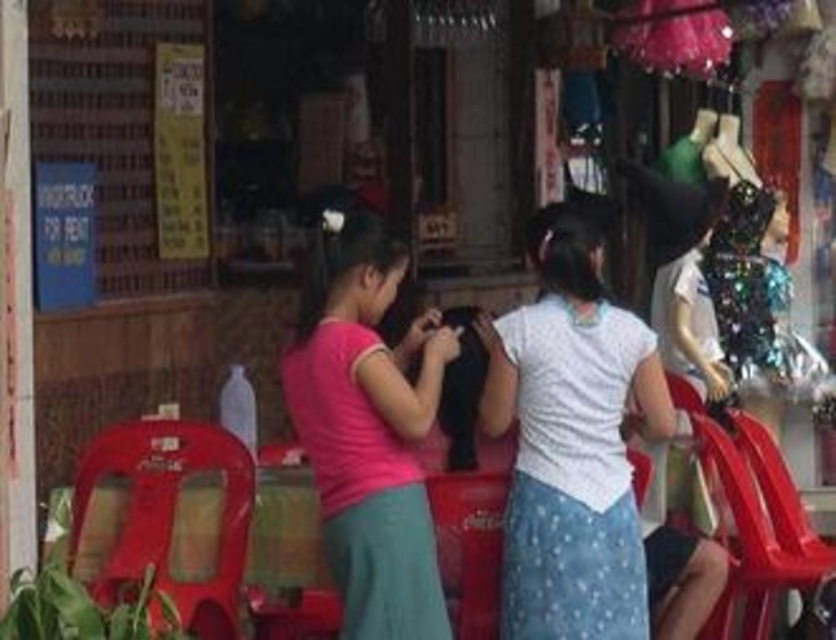
Question: Which of the following is the farthest from the observer?

Choices:
 (A) (748, 301)
 (B) (543, 262)
 (C) (696, 412)

Answer: (A)

Question: Is white matte shirt at center closer to camera compared to matte plastic chair at lower left?

Choices:
 (A) no
 (B) yes

Answer: (A)

Question: Which object is positioned closest to the pink matte shirt at center?

Choices:
 (A) white matte shirt at center
 (B) metallic red chair at lower right
 (C) matte plastic chair at lower left

Answer: (A)

Question: Considering the relative positions of white matte shirt at center and metallic red chair at lower right in the image provided, where is white matte shirt at center located with respect to metallic red chair at lower right?

Choices:
 (A) above
 (B) below

Answer: (A)

Question: Is metallic red chair at lower right behind sparkly sequined dress at right?

Choices:
 (A) no
 (B) yes

Answer: (A)

Question: Among these points, which one is farthest from the camera?

Choices:
 (A) (403, 584)
 (B) (726, 212)

Answer: (B)